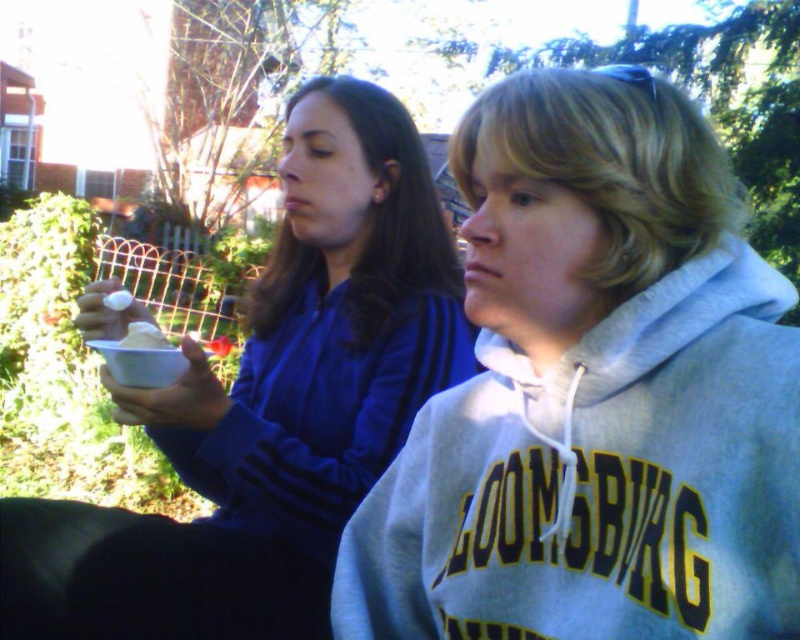
Where is `gray fleece sweatshirt at center`? gray fleece sweatshirt at center is located at coordinates (594, 394).

Can you confirm if gray fleece sweatshirt at center is shorter than white matte cup at center?

In fact, gray fleece sweatshirt at center may be taller than white matte cup at center.

I want to click on gray fleece sweatshirt at center, so click(x=594, y=394).

You are a GUI agent. You are given a task and a screenshot of the screen. Output one action in this format:
    pyautogui.click(x=<x>, y=<y>)
    Task: Click on the gray fleece sweatshirt at center
    
    Given the screenshot: What is the action you would take?
    pyautogui.click(x=594, y=394)

Between gray fleece sweatshirt at center and matte blue sweatshirt at center, which one appears on the right side from the viewer's perspective?

From the viewer's perspective, gray fleece sweatshirt at center appears more on the right side.

Between point (612, 241) and point (290, 218), which one is positioned in front?

Positioned in front is point (612, 241).

Identify the location of gray fleece sweatshirt at center. [x=594, y=394].

Is matte blue sweatshirt at center to the left of white matte cup at center from the viewer's perspective?

Incorrect, matte blue sweatshirt at center is not on the left side of white matte cup at center.

Which is behind, point (296, 160) or point (144, 348)?

Point (296, 160)

Find the location of `matte blue sweatshirt at center`. matte blue sweatshirt at center is located at coordinates click(270, 406).